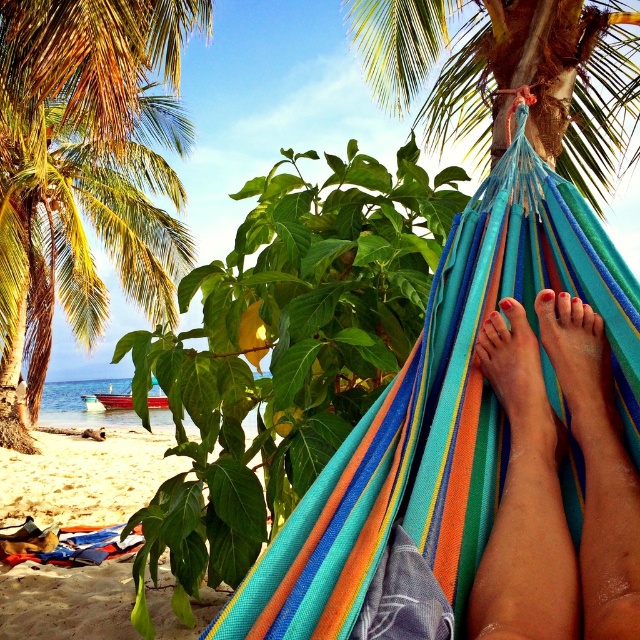
Question: Estimate the real-world distances between objects in this image. Which object is closer to the multicolored striped hammock at center?

Choices:
 (A) green leafy palm tree at upper center
 (B) smooth skin feet at center
 (C) green leafy palm tree at upper left
 (D) smooth skin legs at hammock center

Answer: (D)

Question: Which object appears closest to the camera in this image?

Choices:
 (A) beach sand at lower left
 (B) green leafy palm tree at upper left
 (C) smooth tan foot at center

Answer: (C)

Question: Is green leafy palm tree at upper center to the left of smooth skin feet at center from the viewer's perspective?

Choices:
 (A) no
 (B) yes

Answer: (A)

Question: Which point is closer to the camera?

Choices:
 (A) smooth skin feet at center
 (B) beach sand at lower left

Answer: (A)

Question: Can you confirm if smooth skin legs at hammock center is smaller than smooth tan foot at center?

Choices:
 (A) yes
 (B) no

Answer: (B)

Question: Can you confirm if smooth skin legs at hammock center is positioned to the left of green leafy palm tree at upper center?

Choices:
 (A) yes
 (B) no

Answer: (A)